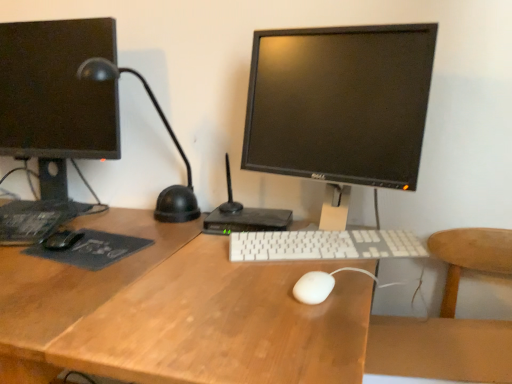
The height and width of the screenshot is (384, 512). Find the location of `vacant region to the right of white matte mouse at center, which ranks as the 1th mouse in bottom-to-top order`. vacant region to the right of white matte mouse at center, which ranks as the 1th mouse in bottom-to-top order is located at coordinates (352, 280).